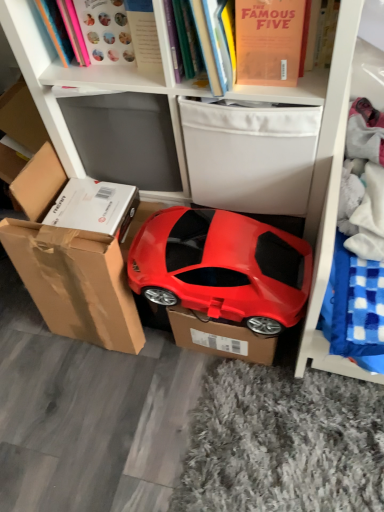
Find the location of a particular element. The height and width of the screenshot is (512, 384). free space in front of brown cardboard box at lower left is located at coordinates (89, 387).